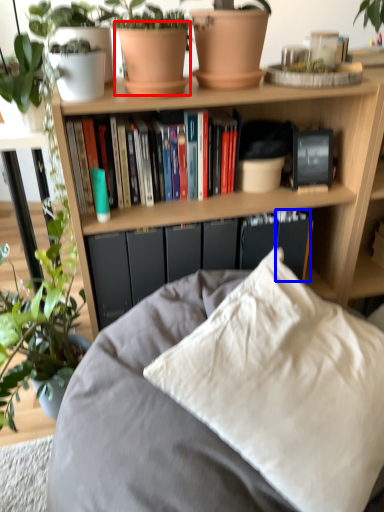
Question: Which of the following is the farthest to the observer, flowerpot (highlighted by a red box) or paperback book (highlighted by a blue box)?

Choices:
 (A) flowerpot
 (B) paperback book

Answer: (B)